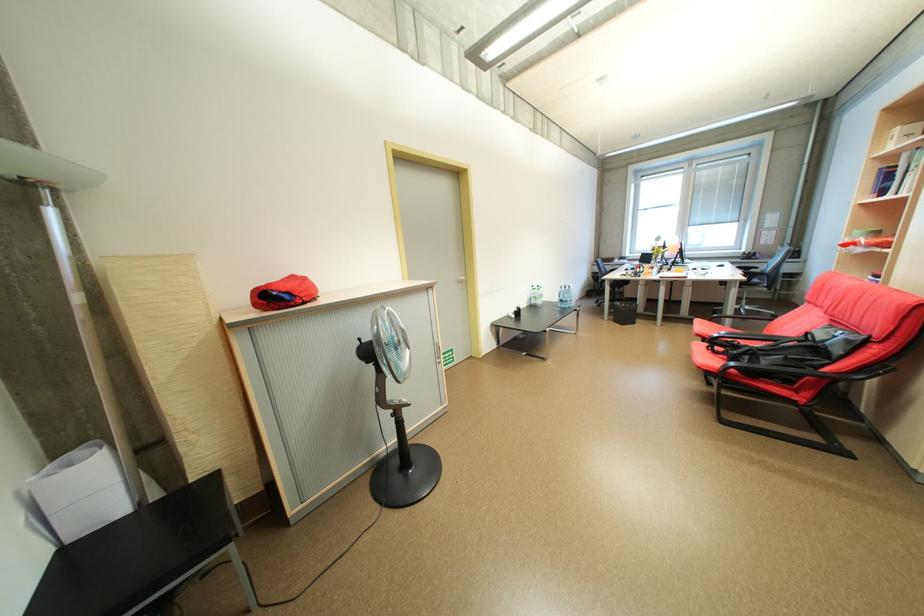
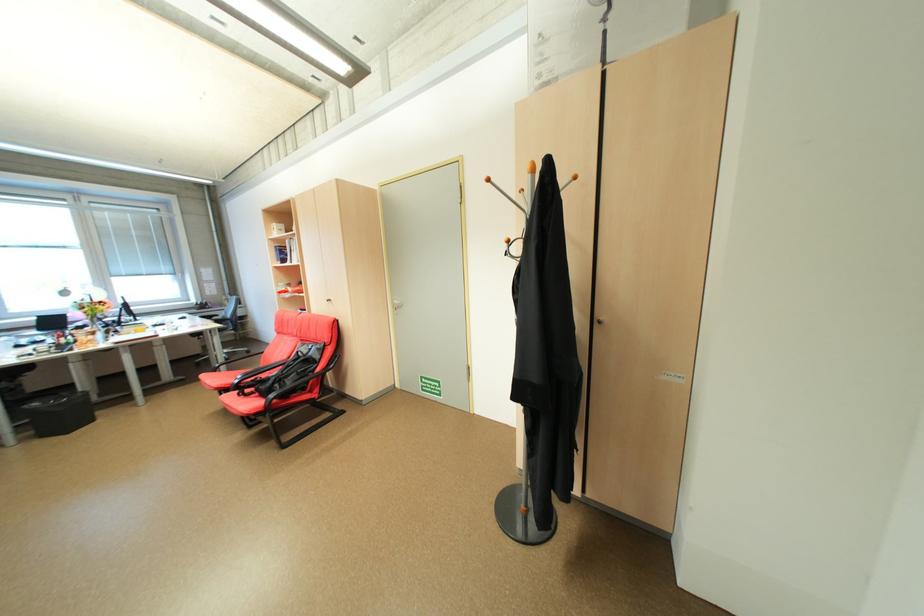
Locate, in the second image, the point that corresponds to (756,358) in the first image.

(286, 386)